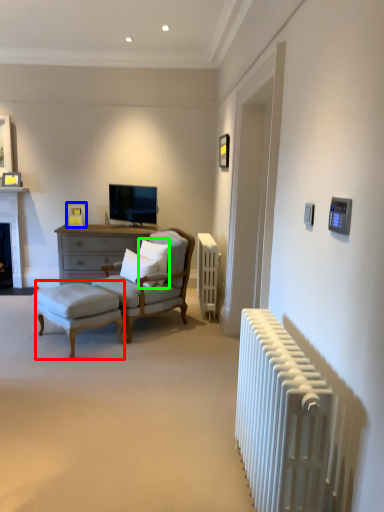
Question: Considering the real-world distances, which object is farthest from table (highlighted by a red box)? picture frame (highlighted by a blue box) or pillow (highlighted by a green box)?

Choices:
 (A) picture frame
 (B) pillow

Answer: (A)